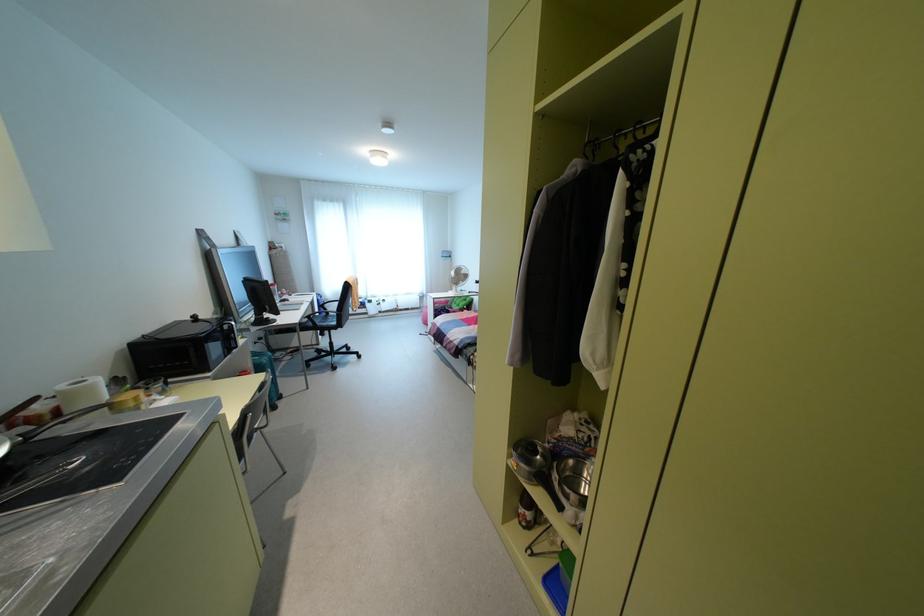
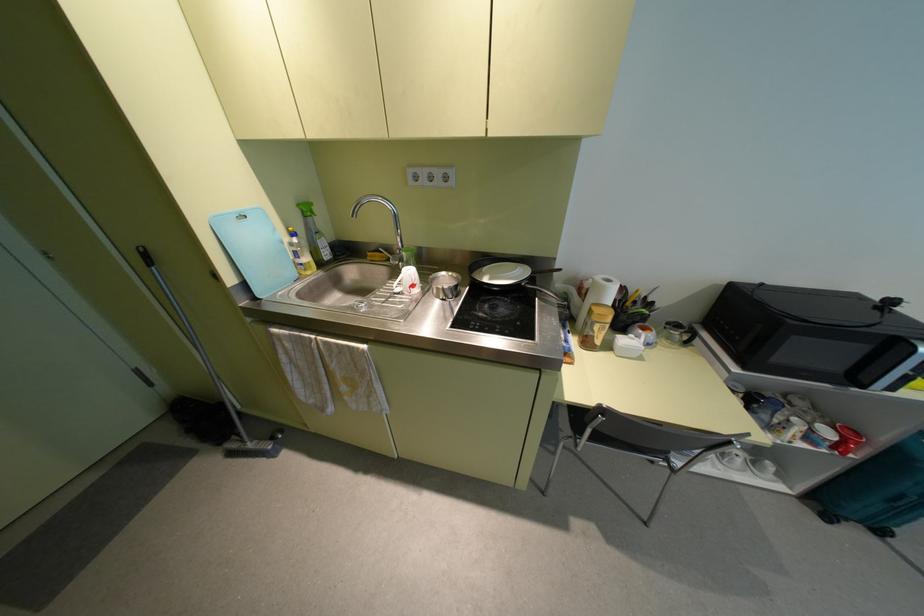
Find the pixel in the second image that matches (x=280, y=395) in the first image.

(880, 531)